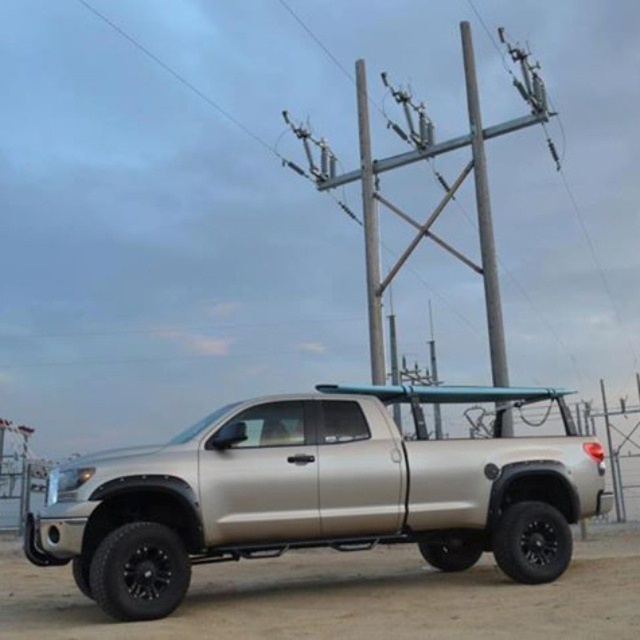
You are a delivery person trying to park your vehicle in a parking spot that requires precise alignment. The parking spot has a center marker at point 0.5 on the x and y axes. Based on the scene, where is the satin silver truck at center located relative to the parking spot center?

The satin silver truck at center is located at point 0.772 on the x axis and 0.494 on the y axis, which is to the right and slightly below the parking spot center at (x=320, y=320).

You are a delivery person who needs to park a truck on the brown dirt at lower center. However, there is a satin silver truck at center already parked there. Can you park your truck next to it without moving the existing truck?

The satin silver truck at center is positioned over brown dirt at lower center, meaning there might not be enough space left on the brown dirt at lower center to park another truck next to it without moving the existing truck.

You are a delivery driver who needs to park your truck in a narrow alley. The alley is as wide as the brown dirt at lower center. Can your truck, which is the same width as the satin silver truck at center, fit through the alley without touching the sides?

The satin silver truck at center is thinner than brown dirt at lower center. Since the alley is as wide as the brown dirt at lower center, the truck can fit through the alley without touching the sides because it is narrower than the alley width.